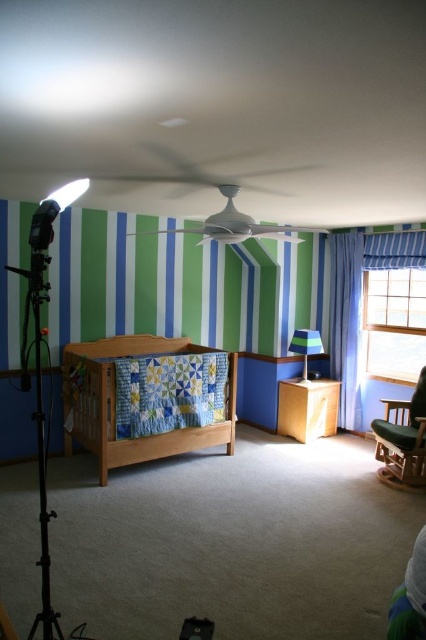
Question: Which object is closer to the camera taking this photo?

Choices:
 (A) blue striped curtain at right
 (B) wooden crib at center
 (C) blue fabric curtain at right

Answer: (B)

Question: From the image, what is the correct spatial relationship of blue striped curtain at right in relation to green fabric lampshade at center?

Choices:
 (A) below
 (B) above

Answer: (B)

Question: Is wooden crib at center to the right of matte gray rocking chair at upper center from the viewer's perspective?

Choices:
 (A) yes
 (B) no

Answer: (B)

Question: Is blue striped curtain at right smaller than green fabric armchair at right?

Choices:
 (A) yes
 (B) no

Answer: (A)

Question: Which point is farther to the camera?

Choices:
 (A) blue striped curtain at right
 (B) wooden crib at center

Answer: (A)

Question: Considering the real-world distances, which object is farthest from the green fabric lampshade at center?

Choices:
 (A) matte gray rocking chair at upper center
 (B) wooden crib at center
 (C) blue striped curtain at right

Answer: (A)